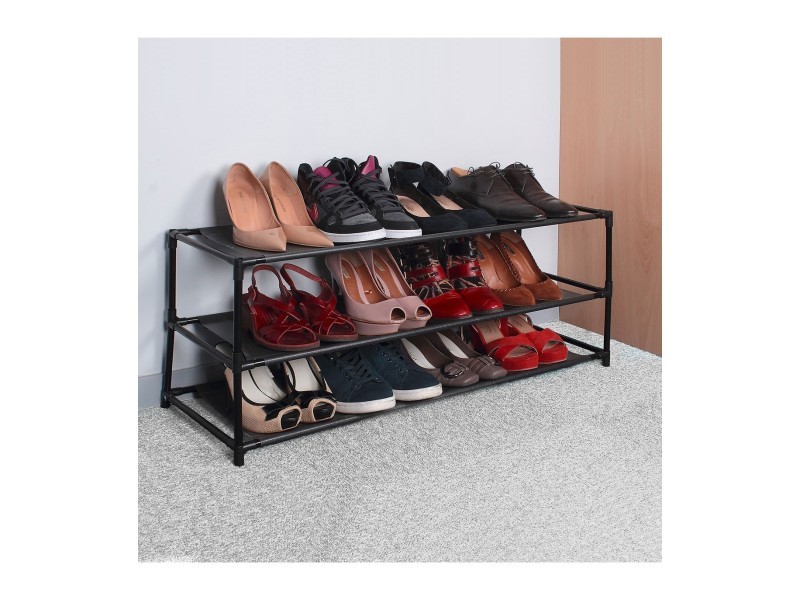
Where is `shoe on bottom shelf`? shoe on bottom shelf is located at coordinates (264, 401), (310, 382), (354, 390), (413, 378), (449, 374), (482, 370), (522, 347), (545, 348).